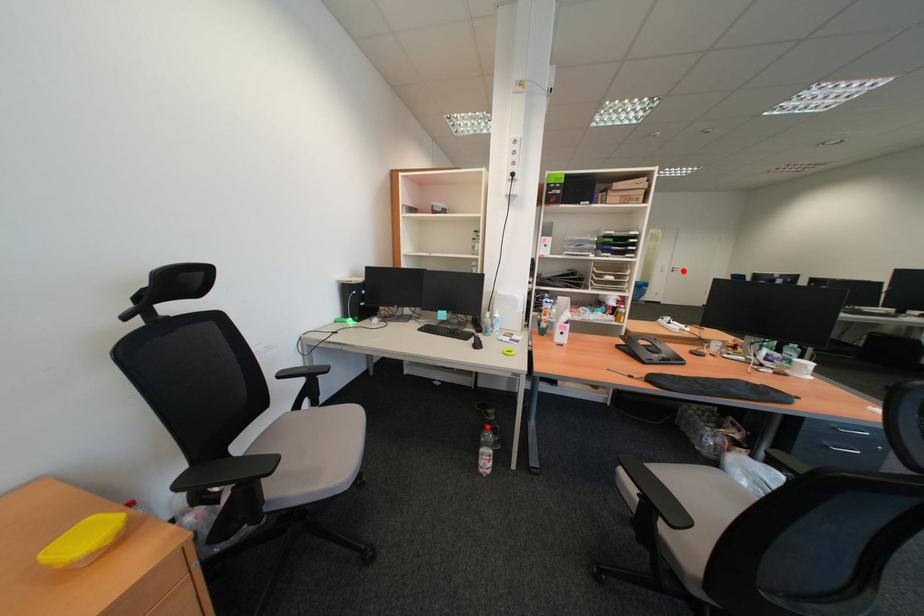
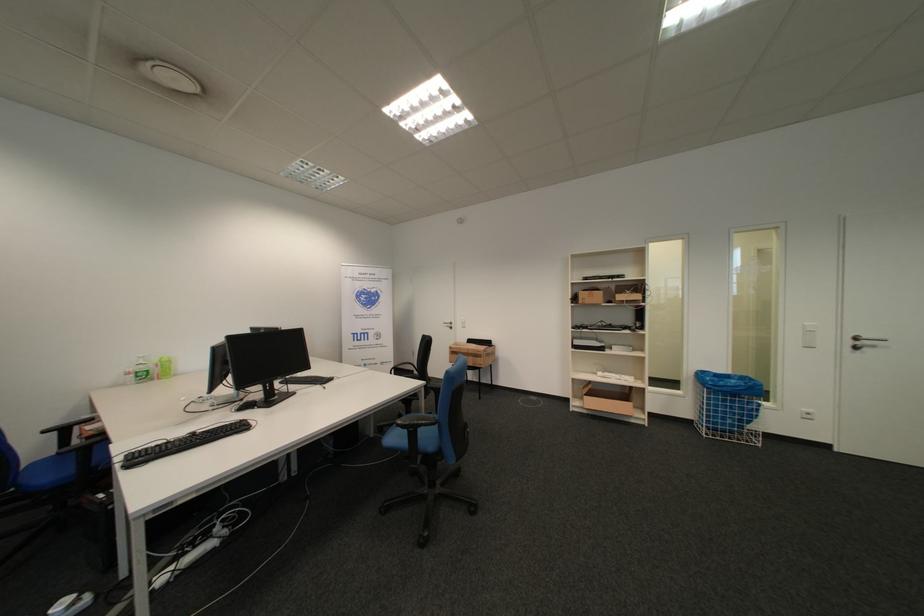
Find the pixel in the second image that matches the highlighted location in the first image.

(862, 344)